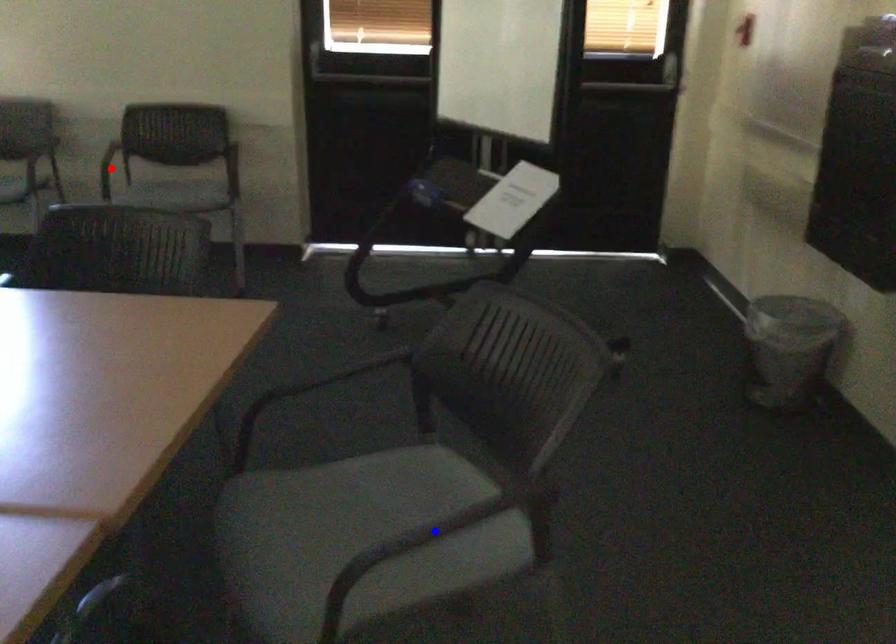
Question: In the image, two points are highlighted. Which point is nearer to the camera? Reply with the corresponding letter.

Choices:
 (A) blue point
 (B) red point

Answer: (A)